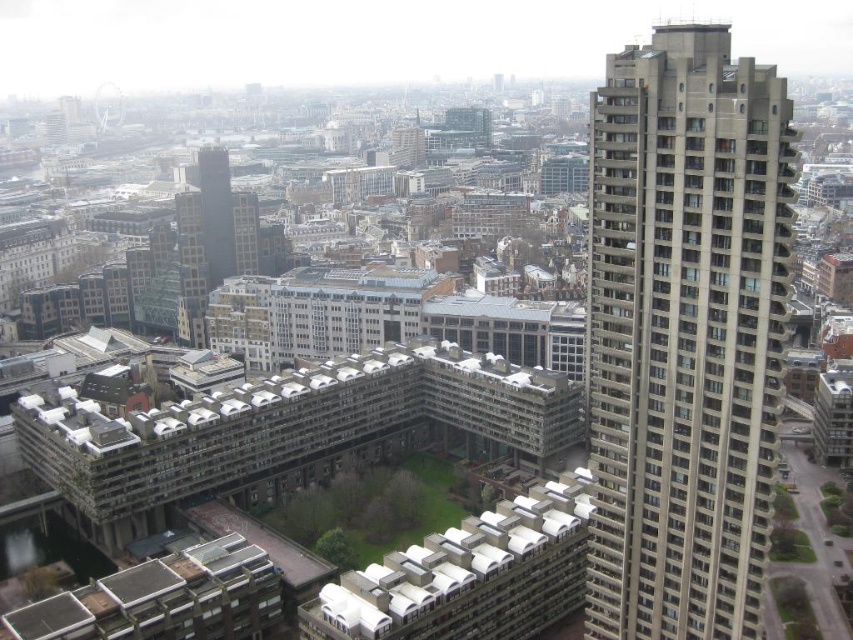
Question: Can you confirm if gray concrete building at right is positioned to the left of smooth glass skyscraper at center-left?

Choices:
 (A) no
 (B) yes

Answer: (A)

Question: Is gray concrete building at right to the left of smooth glass skyscraper at center-left from the viewer's perspective?

Choices:
 (A) no
 (B) yes

Answer: (A)

Question: Which object appears closest to the camera in this image?

Choices:
 (A) gray concrete building at right
 (B) smooth glass skyscraper at center-left

Answer: (A)

Question: Observing the image, what is the correct spatial positioning of gray concrete building at right in reference to smooth glass skyscraper at center-left?

Choices:
 (A) above
 (B) below

Answer: (B)

Question: Which point is farther to the camera?

Choices:
 (A) smooth glass skyscraper at center-left
 (B) gray concrete building at right

Answer: (A)

Question: Among these points, which one is farthest from the camera?

Choices:
 (A) (223, 240)
 (B) (637, 584)

Answer: (A)